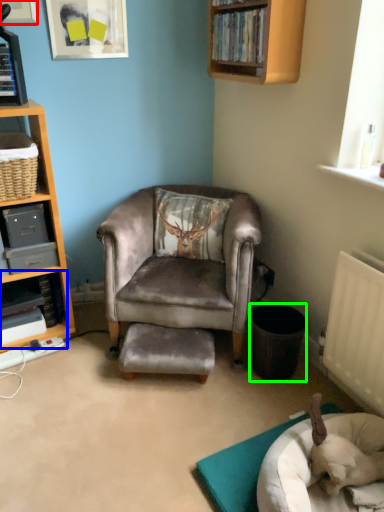
Question: Which object is positioned closest to shelf in the corner of a room with a picture frame on the wall (highlighted by a red box)? Select from shelf (highlighted by a blue box) and trash bin/can (highlighted by a green box).

Choices:
 (A) shelf
 (B) trash bin/can

Answer: (A)